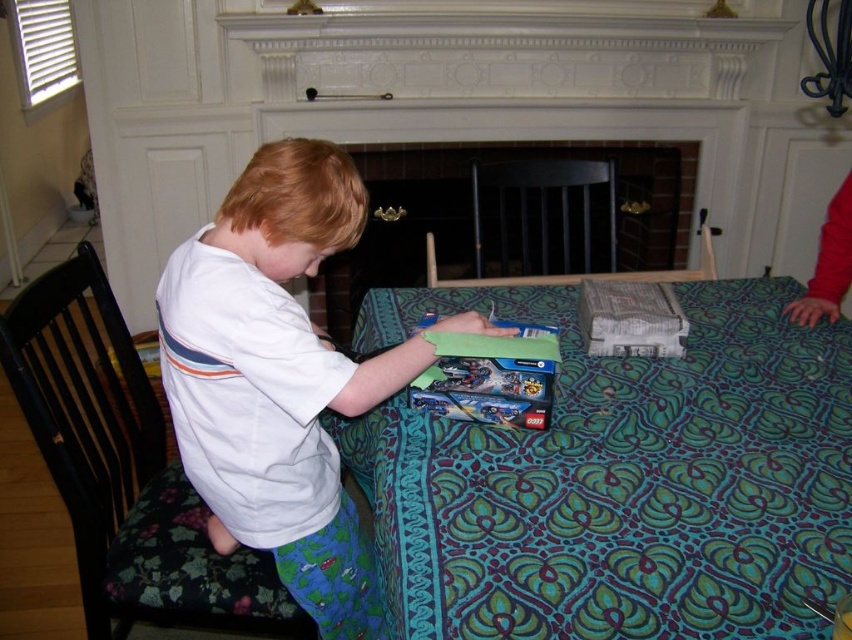
The width and height of the screenshot is (852, 640). What do you see at coordinates (620, 481) in the screenshot? I see `green patterned fabric at center` at bounding box center [620, 481].

Which is in front, point (498, 566) or point (191, 248)?

Point (498, 566) is in front.

Which is behind, point (707, 625) or point (344, 198)?

The point (344, 198) is more distant.

Locate an element on the screen. This screenshot has height=640, width=852. green patterned fabric at center is located at coordinates (620, 481).

Who is higher up, white cotton shirt at center or brick fireplace at center?

brick fireplace at center is above.

Image resolution: width=852 pixels, height=640 pixels. Describe the element at coordinates (275, 378) in the screenshot. I see `white cotton shirt at center` at that location.

Who is more forward, (314, 579) or (582, 140)?

Positioned in front is point (314, 579).

I want to click on white cotton shirt at center, so click(x=275, y=378).

Looking at this image, who is shorter, green patterned fabric at center or brick fireplace at center?

green patterned fabric at center is shorter.

Between green patterned fabric at center and brick fireplace at center, which one has more height?

With more height is brick fireplace at center.

Is point (830, 337) behind point (636, 122)?

That is False.

Where is `green patterned fabric at center`? The width and height of the screenshot is (852, 640). green patterned fabric at center is located at coordinates (620, 481).